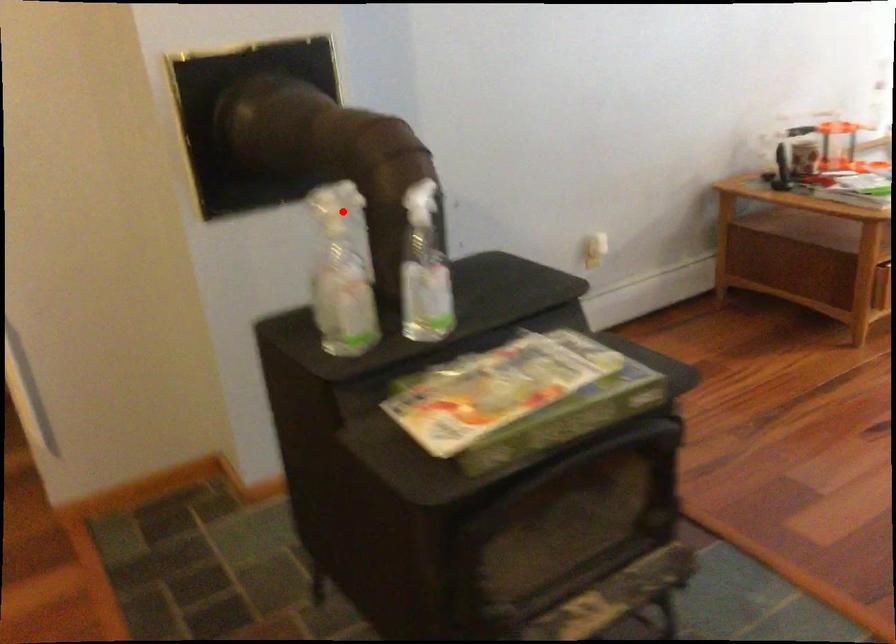
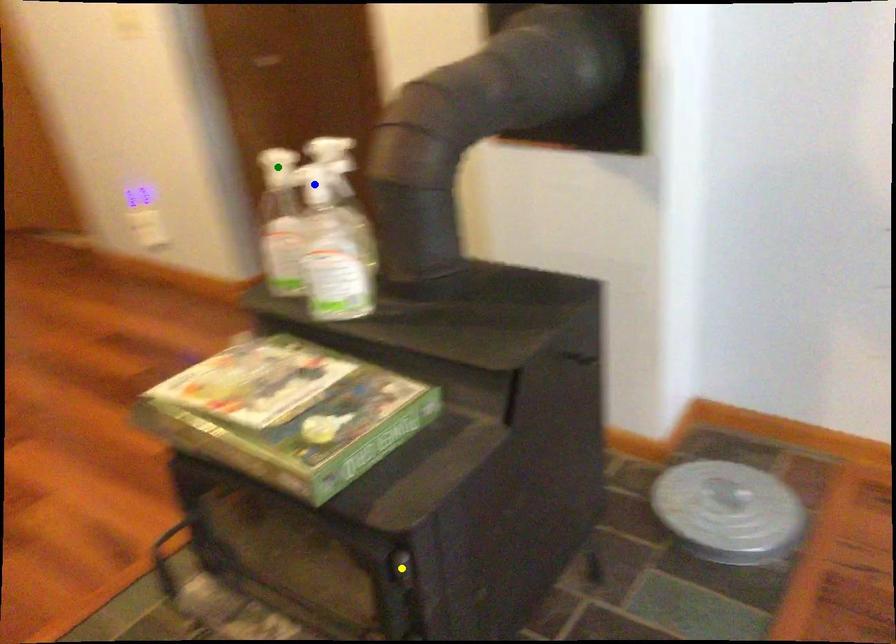
Question: I am providing you with two images of the same scene from different viewpoints. A red point is marked on the first image. You are given multiple points on the second image. Can you choose the point in image 2 that corresponds to the point in image 1?

Choices:
 (A) yellow point
 (B) green point
 (C) blue point

Answer: (B)